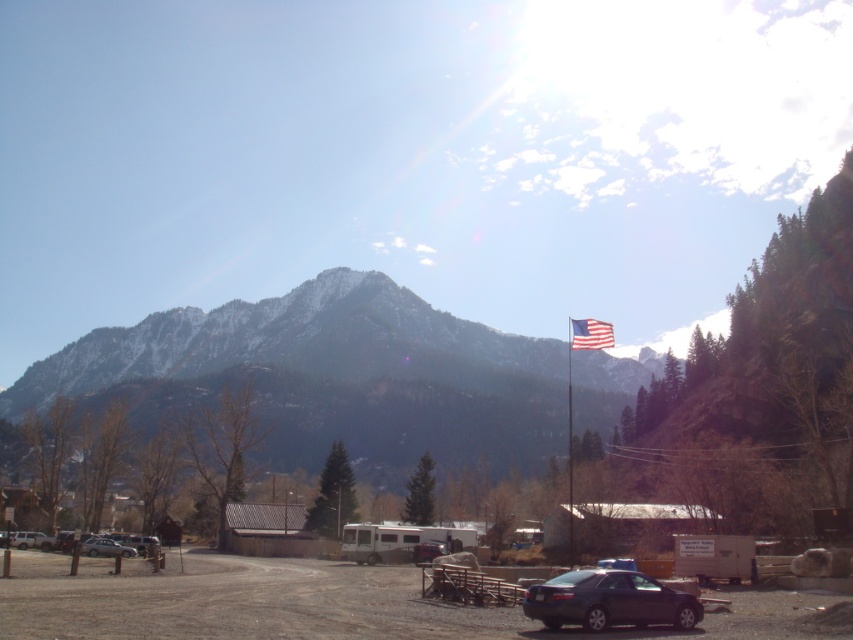
You are standing at the point marked by the coordinates point (x=329, y=380) in the image. Looking around, you see the snowy rock mountain range at upper center. Which direction should you walk to reach the dark colored sedan in the bottom right corner?

You should walk towards the bottom right direction from the point (x=329, y=380) to reach the dark colored sedan in the bottom right corner.

You are standing in the parking area and want to take a photo of the snowy rock mountain range at upper center without any vehicles blocking the view. Is the silver metallic sedan at lower left positioned in a way that it might block the view of the mountain range?

A: The snowy rock mountain range at upper center is wider than the silver metallic sedan at lower left, so even if the sedan is in the frame, the majority of the mountain range should still be visible. However, the sedan might partially block the lower left portion of the mountain range depending on your camera angle and position.